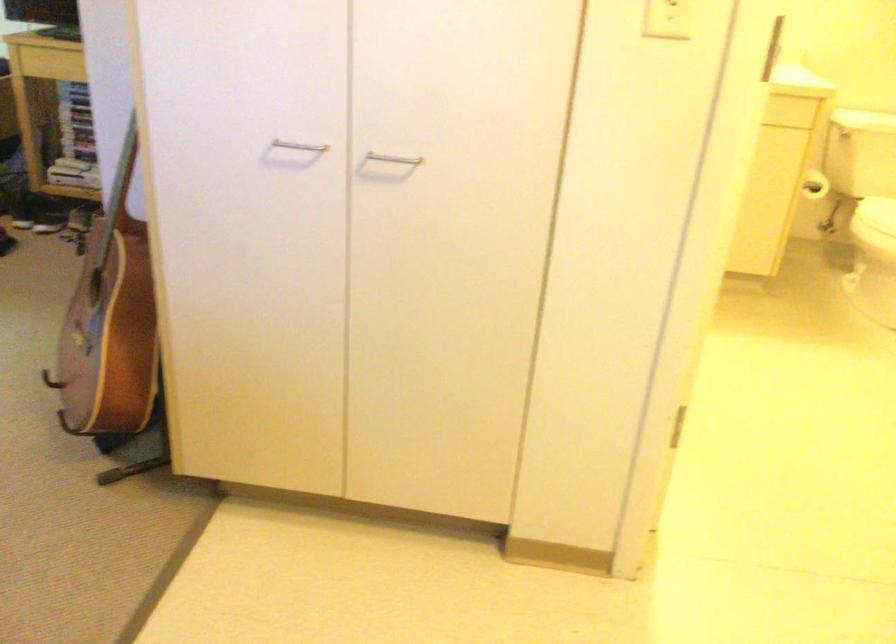
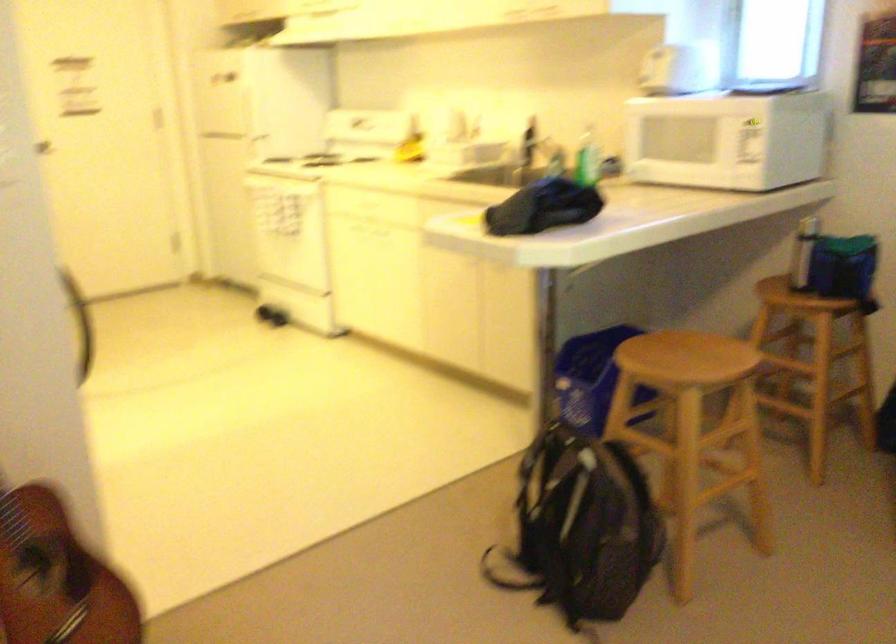
In the second image, find the point that corresponds to [80,339] in the first image.

(56, 576)